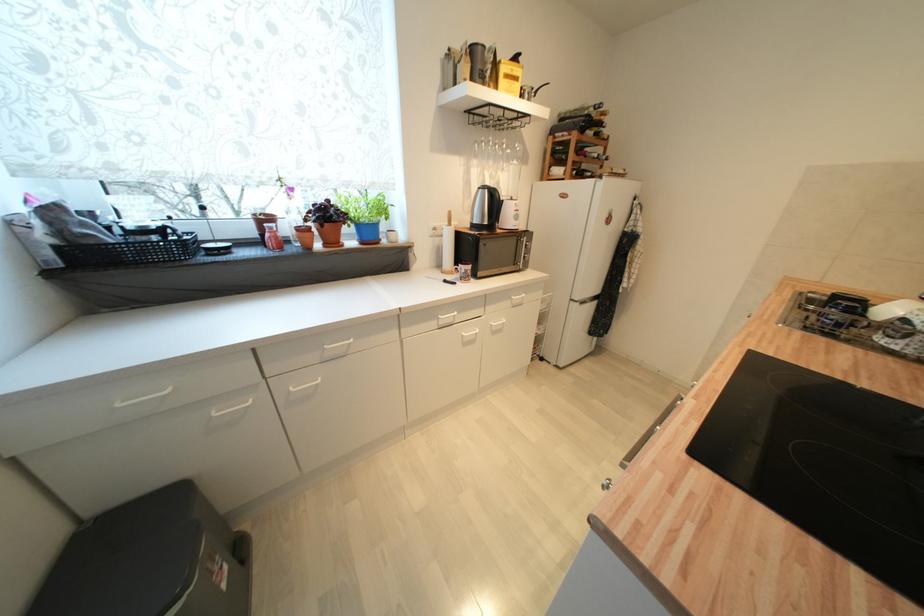
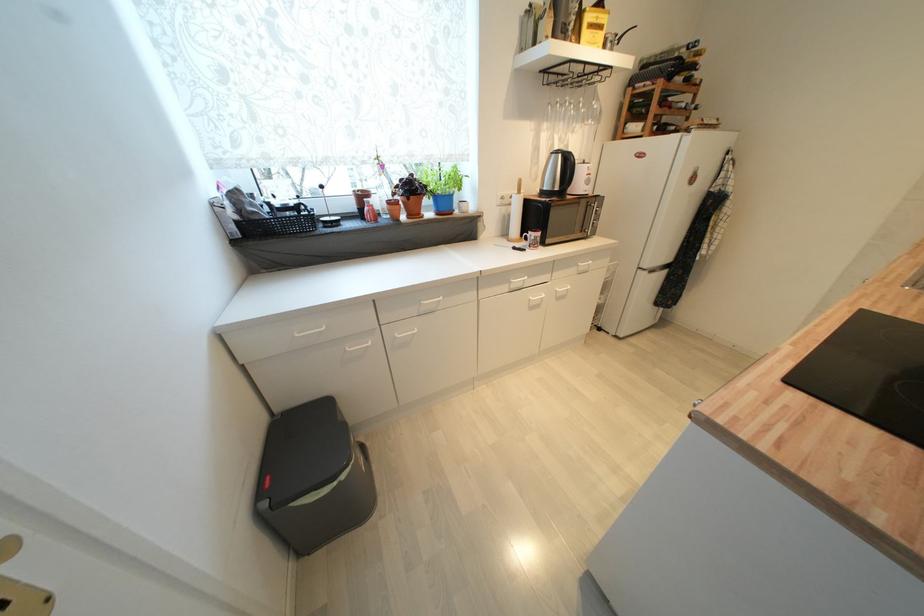
In the second image, find the point that corresponds to point (271, 217) in the first image.

(368, 193)